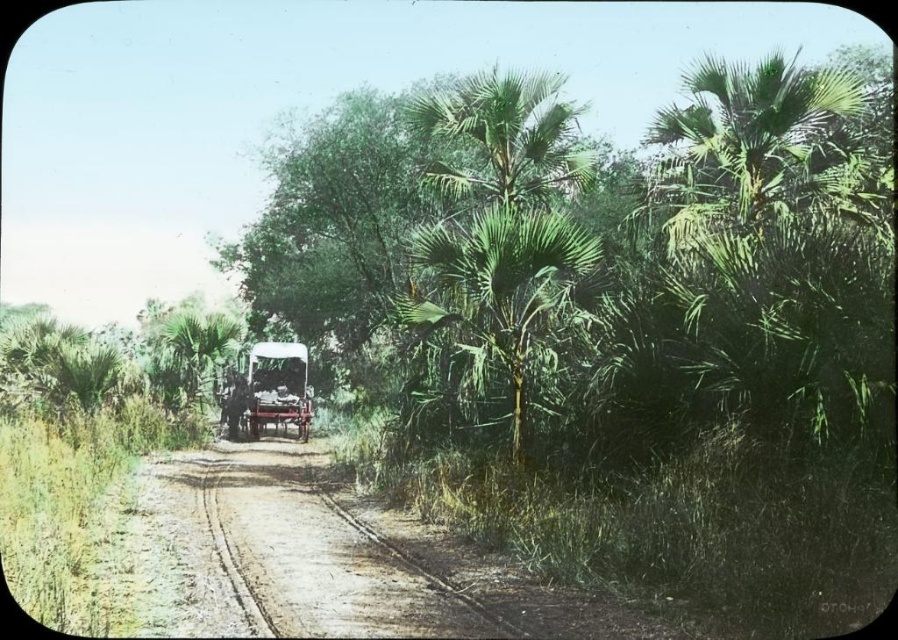
Question: Which object appears closest to the camera in this image?

Choices:
 (A) brown dirt track at center
 (B) green leafy palm tree at center
 (C) green leafy palm at center

Answer: (A)

Question: Which of the following is the closest to the observer?

Choices:
 (A) wooden cart at center
 (B) green leafy palm tree at center

Answer: (A)

Question: Where is brown dirt track at center located in relation to green leafy palm at center in the image?

Choices:
 (A) left
 (B) right

Answer: (A)

Question: Among these objects, which one is farthest from the camera?

Choices:
 (A) green leafy palm at center
 (B) brown dirt track at center

Answer: (A)

Question: Is wooden cart at center positioned behind green leafy palm tree at center?

Choices:
 (A) yes
 (B) no

Answer: (B)

Question: Can you confirm if green leafy palm at center is thinner than green leafy palm tree at center?

Choices:
 (A) yes
 (B) no

Answer: (A)